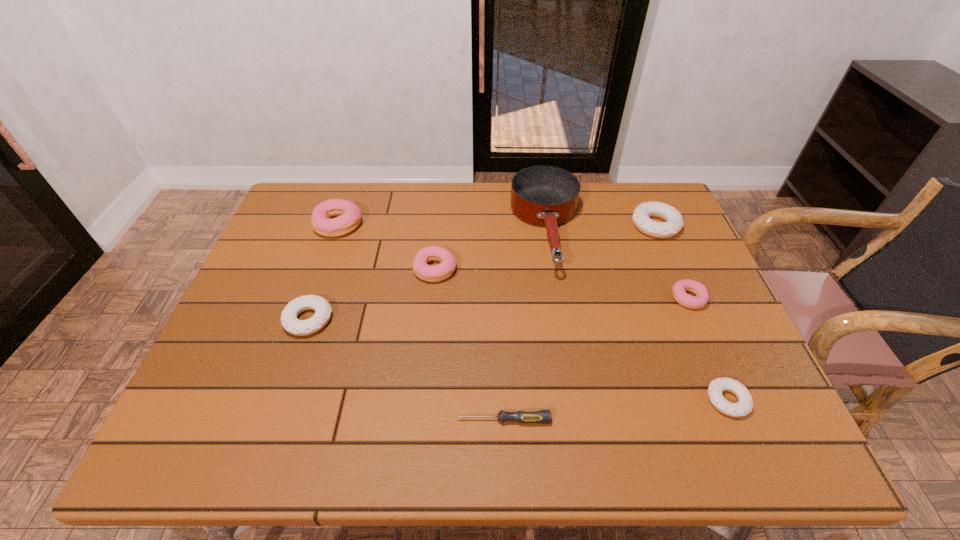
Where is `the nearest pink doughnut`? the nearest pink doughnut is located at coordinates (680, 287).

The image size is (960, 540). I want to click on the smallest white doughnut, so click(744, 406).

Identify the location of the shortest doughnut. (744, 406).

Where is `screwdriver`? screwdriver is located at coordinates (522, 416).

Where is `free region located 0.150m on the handle side of the pan`? free region located 0.150m on the handle side of the pan is located at coordinates (563, 327).

Where is `free space located on the front of the seventh shortest object`? Image resolution: width=960 pixels, height=540 pixels. free space located on the front of the seventh shortest object is located at coordinates (317, 288).

I want to click on vacant space located on the front of the biggest white doughnut, so (688, 301).

The height and width of the screenshot is (540, 960). I want to click on free spot located on the right of the fourth doughnut from right to left, so [500, 269].

The width and height of the screenshot is (960, 540). I want to click on free space located on the right of the second smallest white doughnut, so click(385, 320).

This screenshot has width=960, height=540. What are the coordinates of `free space located 0.250m on the front of the nearest pink doughnut` in the screenshot? It's located at (733, 402).